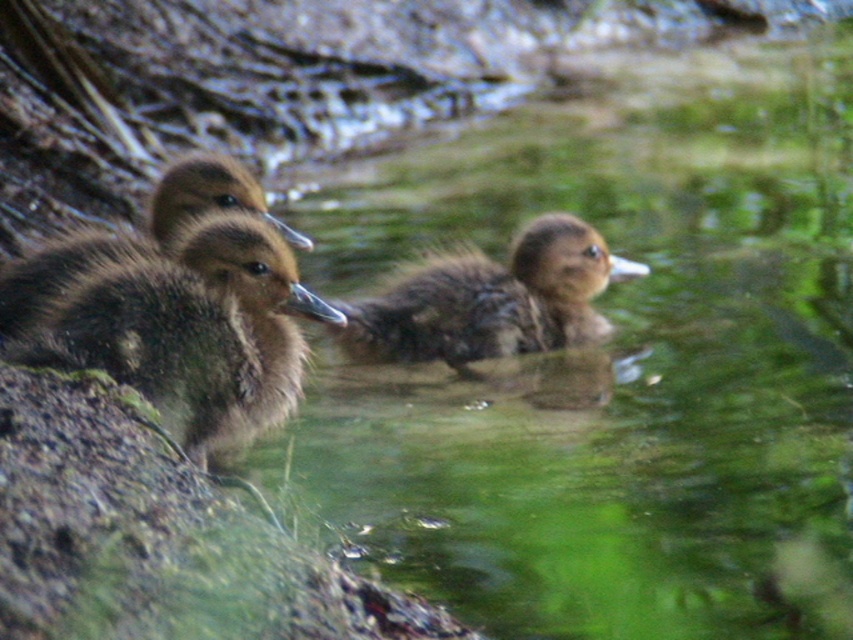
You are observing a group of ducklings near a body of water. You notice a point marked at coordinates [173,323]. What is located at that point?

A brown fuzzy duckling at left is located at point [173,323].

You are a parent duck observing your ducklings. You notice two ducklings, the brown fuzzy duckling at left and the brown fuzzy duckling at center. Which duckling is farther away from the other?

The brown fuzzy duckling at left is 24.13 inches away from the brown fuzzy duckling at center, so the brown fuzzy duckling at left is farther away from the brown fuzzy duckling at center.

You are a photographer trying to capture the brown fuzzy duckling at left. The duckling is located at coordinates point 0.505, 0.204. If you move your camera 0.05 units to the right along the x axis, will you still be able to see the duckling?

Yes, moving 0.05 units to the right along the x axis will still keep the brown fuzzy duckling at left within your view since it is located at point (173, 323).